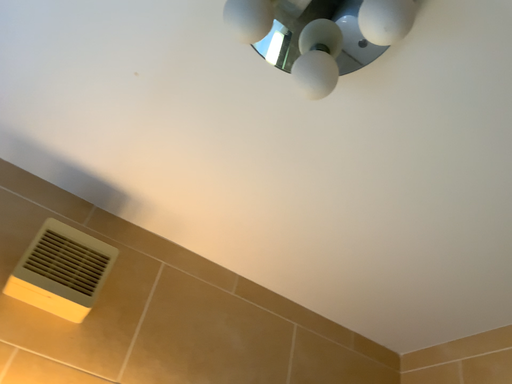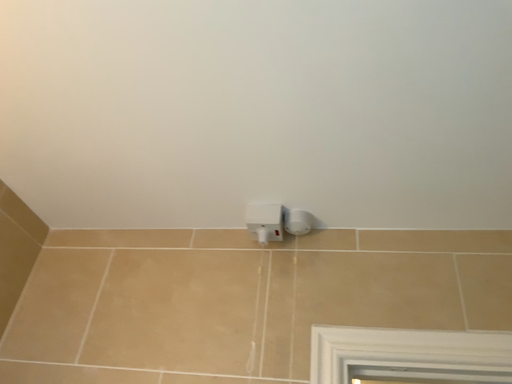
Question: Which way did the camera rotate in the video?

Choices:
 (A) rotated left
 (B) rotated right

Answer: (B)